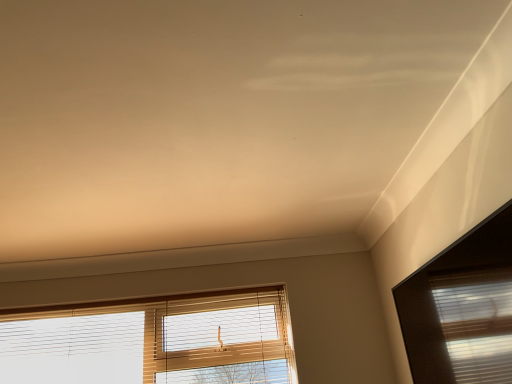
What do you see at coordinates (152, 341) in the screenshot? I see `wooden blinds at lower center, the 1th window in the back-to-front sequence` at bounding box center [152, 341].

Locate an element on the screen. wooden blinds at lower center, arranged as the second window when viewed from the front is located at coordinates (152, 341).

This screenshot has width=512, height=384. Describe the element at coordinates (452, 284) in the screenshot. I see `matte glass window at upper right, acting as the first window starting from the right` at that location.

The image size is (512, 384). In order to click on matte glass window at upper right, the first window in the front-to-back sequence in this screenshot , I will do `click(452, 284)`.

The image size is (512, 384). What are the coordinates of `wooden blinds at lower center, which is the second window in right-to-left order` in the screenshot? It's located at (152, 341).

Based on the photo, considering the positions of objects matte glass window at upper right, the first window in the front-to-back sequence, and wooden blinds at lower center, arranged as the second window when viewed from the front, in the image provided, who is more to the left, matte glass window at upper right, the first window in the front-to-back sequence, or wooden blinds at lower center, arranged as the second window when viewed from the front,?

Positioned to the left is wooden blinds at lower center, arranged as the second window when viewed from the front.

Is the position of matte glass window at upper right, the first window in the front-to-back sequence, more distant than that of wooden blinds at lower center, the 1th window in the back-to-front sequence?

No.

Is point (440, 376) closer to viewer compared to point (208, 331)?

Yes, point (440, 376) is closer to viewer.

From the image's perspective, relative to wooden blinds at lower center, arranged as the second window when viewed from the front, is matte glass window at upper right, the second window from the left, above or below?

From the image's perspective, matte glass window at upper right, the second window from the left, appears above wooden blinds at lower center, arranged as the second window when viewed from the front.

From a real-world perspective, relative to wooden blinds at lower center, which is the second window in right-to-left order, is matte glass window at upper right, the second window from the left, vertically above or below?

matte glass window at upper right, the second window from the left, is situated lower than wooden blinds at lower center, which is the second window in right-to-left order, in the real world.

Does matte glass window at upper right, the 2th window when ordered from back to front, have a lesser width compared to wooden blinds at lower center, which is the second window in right-to-left order?

Yes.

Is matte glass window at upper right, the first window in the front-to-back sequence, shorter than wooden blinds at lower center, the 1th window in the back-to-front sequence?

Yes.

In terms of size, does matte glass window at upper right, the 2th window when ordered from back to front, appear bigger or smaller than wooden blinds at lower center, the first window viewed from the left?

Clearly, matte glass window at upper right, the 2th window when ordered from back to front, is smaller in size than wooden blinds at lower center, the first window viewed from the left.

Is wooden blinds at lower center, which is the second window in right-to-left order, a part of matte glass window at upper right, the 2th window when ordered from back to front?

Actually, wooden blinds at lower center, which is the second window in right-to-left order, is outside matte glass window at upper right, the 2th window when ordered from back to front.

Based on the photo, is matte glass window at upper right, acting as the first window starting from the right, far away from wooden blinds at lower center, the first window viewed from the left?

Yes, matte glass window at upper right, acting as the first window starting from the right, is far from wooden blinds at lower center, the first window viewed from the left.

Is matte glass window at upper right, the 2th window when ordered from back to front, oriented towards wooden blinds at lower center, the 1th window in the back-to-front sequence?

Yes, matte glass window at upper right, the 2th window when ordered from back to front, is oriented towards wooden blinds at lower center, the 1th window in the back-to-front sequence.

How far apart are matte glass window at upper right, the second window from the left, and wooden blinds at lower center, which is the second window in right-to-left order?

1.25 meters.

This screenshot has height=384, width=512. I want to click on window that is on the left side of matte glass window at upper right, the second window from the left, so click(152, 341).

Considering the relative positions of wooden blinds at lower center, which is the second window in right-to-left order, and matte glass window at upper right, the second window from the left, in the image provided, is wooden blinds at lower center, which is the second window in right-to-left order, to the right of matte glass window at upper right, the second window from the left, from the viewer's perspective?

In fact, wooden blinds at lower center, which is the second window in right-to-left order, is to the left of matte glass window at upper right, the second window from the left.

Is wooden blinds at lower center, which is the second window in right-to-left order, in front of or behind matte glass window at upper right, acting as the first window starting from the right, in the image?

wooden blinds at lower center, which is the second window in right-to-left order, is positioned farther from the viewer than matte glass window at upper right, acting as the first window starting from the right.

Which point is more distant from viewer, (153, 352) or (481, 335)?

Positioned behind is point (153, 352).

From the image's perspective, relative to matte glass window at upper right, acting as the first window starting from the right, is wooden blinds at lower center, the first window viewed from the left, above or below?

Based on their image positions, wooden blinds at lower center, the first window viewed from the left, is located beneath matte glass window at upper right, acting as the first window starting from the right.

Consider the image. From a real-world perspective, between wooden blinds at lower center, the first window viewed from the left, and matte glass window at upper right, the 2th window when ordered from back to front, who is vertically lower?

matte glass window at upper right, the 2th window when ordered from back to front, from a real-world perspective.

Looking at their sizes, would you say wooden blinds at lower center, the first window viewed from the left, is wider or thinner than matte glass window at upper right, acting as the first window starting from the right?

Considering their sizes, wooden blinds at lower center, the first window viewed from the left, looks broader than matte glass window at upper right, acting as the first window starting from the right.

Considering the relative sizes of wooden blinds at lower center, arranged as the second window when viewed from the front, and matte glass window at upper right, the 2th window when ordered from back to front, in the image provided, is wooden blinds at lower center, arranged as the second window when viewed from the front, shorter than matte glass window at upper right, the 2th window when ordered from back to front,?

No, wooden blinds at lower center, arranged as the second window when viewed from the front, is not shorter than matte glass window at upper right, the 2th window when ordered from back to front.

Looking at this image, is wooden blinds at lower center, arranged as the second window when viewed from the front, bigger or smaller than matte glass window at upper right, the first window in the front-to-back sequence?

wooden blinds at lower center, arranged as the second window when viewed from the front, is bigger than matte glass window at upper right, the first window in the front-to-back sequence.

Is wooden blinds at lower center, arranged as the second window when viewed from the front, not inside matte glass window at upper right, the 2th window when ordered from back to front?

Yes, wooden blinds at lower center, arranged as the second window when viewed from the front, is not within matte glass window at upper right, the 2th window when ordered from back to front.

Is wooden blinds at lower center, which is the second window in right-to-left order, touching matte glass window at upper right, acting as the first window starting from the right?

wooden blinds at lower center, which is the second window in right-to-left order, and matte glass window at upper right, acting as the first window starting from the right, are not in contact.

Is wooden blinds at lower center, the 1th window in the back-to-front sequence, oriented towards matte glass window at upper right, acting as the first window starting from the right?

Yes, wooden blinds at lower center, the 1th window in the back-to-front sequence, is oriented towards matte glass window at upper right, acting as the first window starting from the right.

Could you measure the distance between wooden blinds at lower center, the 1th window in the back-to-front sequence, and matte glass window at upper right, acting as the first window starting from the right?

wooden blinds at lower center, the 1th window in the back-to-front sequence, and matte glass window at upper right, acting as the first window starting from the right, are 4.11 feet apart.

Where is `window that is above the matte glass window at upper right, the second window from the left (from a real-world perspective)`? window that is above the matte glass window at upper right, the second window from the left (from a real-world perspective) is located at coordinates point(152,341).

Where is `window in front of the wooden blinds at lower center, the 1th window in the back-to-front sequence`? The width and height of the screenshot is (512, 384). window in front of the wooden blinds at lower center, the 1th window in the back-to-front sequence is located at coordinates (452, 284).

This screenshot has height=384, width=512. What are the coordinates of `window above the wooden blinds at lower center, the first window viewed from the left (from the image's perspective)` in the screenshot? It's located at (452, 284).